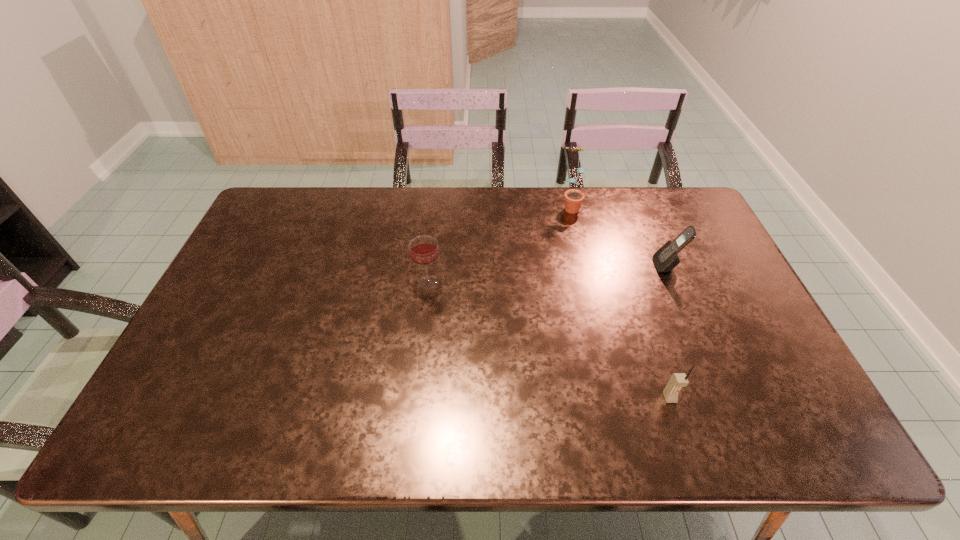
Where is `the farthest object`? the farthest object is located at coordinates (573, 198).

The image size is (960, 540). I want to click on sunflower, so click(x=573, y=198).

Locate an element on the screen. This screenshot has width=960, height=540. the rightmost object is located at coordinates 666,258.

Locate an element on the screen. This screenshot has width=960, height=540. the farther cellular telephone is located at coordinates (666, 258).

Identify the location of wineglass. (423, 250).

Find the location of a particular element. This screenshot has width=960, height=540. the nearest object is located at coordinates (678, 380).

You are a GUI agent. You are given a task and a screenshot of the screen. Output one action in this format:
    pyautogui.click(x=<x>, y=<y>)
    Task: Click on the second object from right to left
    This screenshot has width=960, height=540.
    Given the screenshot: What is the action you would take?
    pyautogui.click(x=678, y=380)

Locate an element on the screen. Image resolution: width=960 pixels, height=540 pixels. vacant space located on the flower of the third object from right to left is located at coordinates click(x=586, y=268).

Where is `free space located 0.060m on the front-facing side of the farther cellular telephone`? This screenshot has height=540, width=960. free space located 0.060m on the front-facing side of the farther cellular telephone is located at coordinates (635, 266).

Image resolution: width=960 pixels, height=540 pixels. What are the coordinates of `vacant space located on the front-facing side of the farther cellular telephone` in the screenshot? It's located at (602, 266).